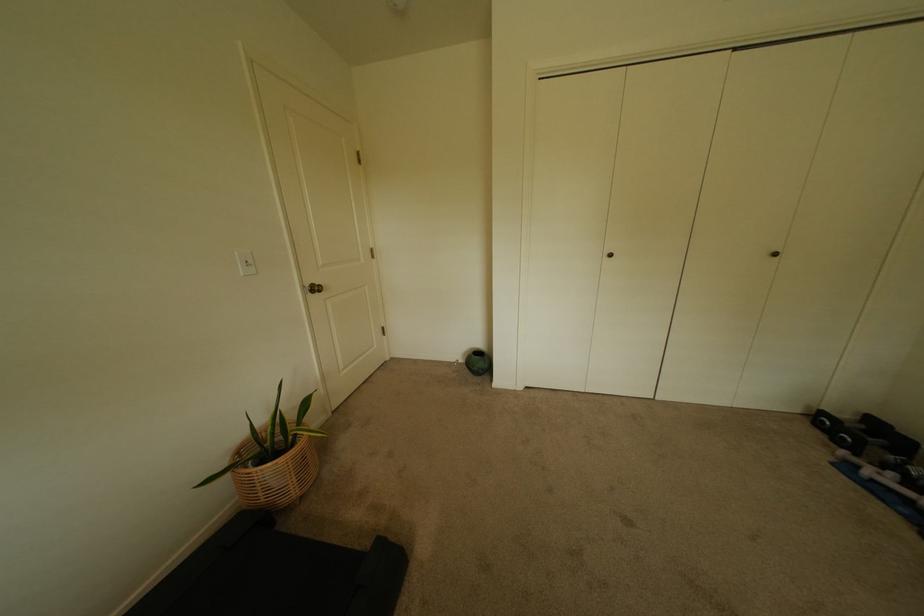
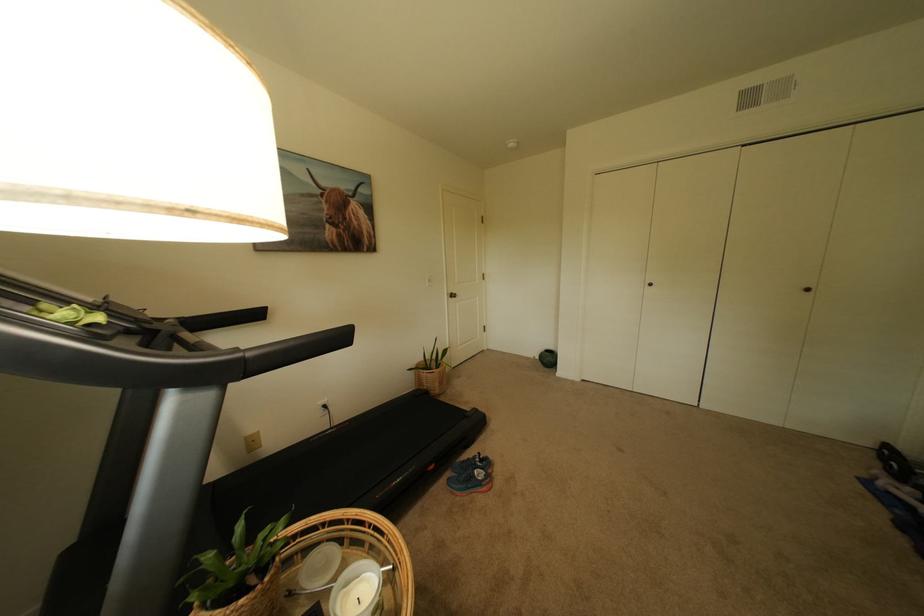
Question: The images are taken continuously from a first-person perspective. In which direction are you moving?

Choices:
 (A) Left
 (B) Right
 (C) Forward
 (D) Backward

Answer: (D)